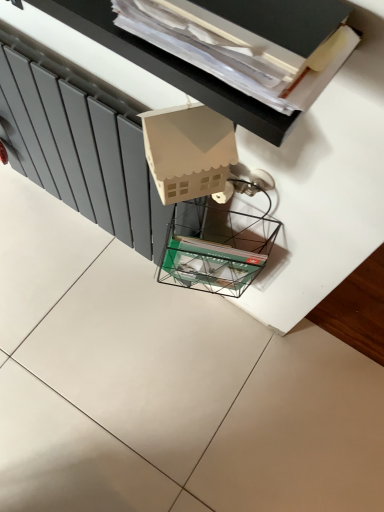
In order to click on free point below matte gray radiator at left (from a real-world perspective) in this screenshot , I will do `click(102, 234)`.